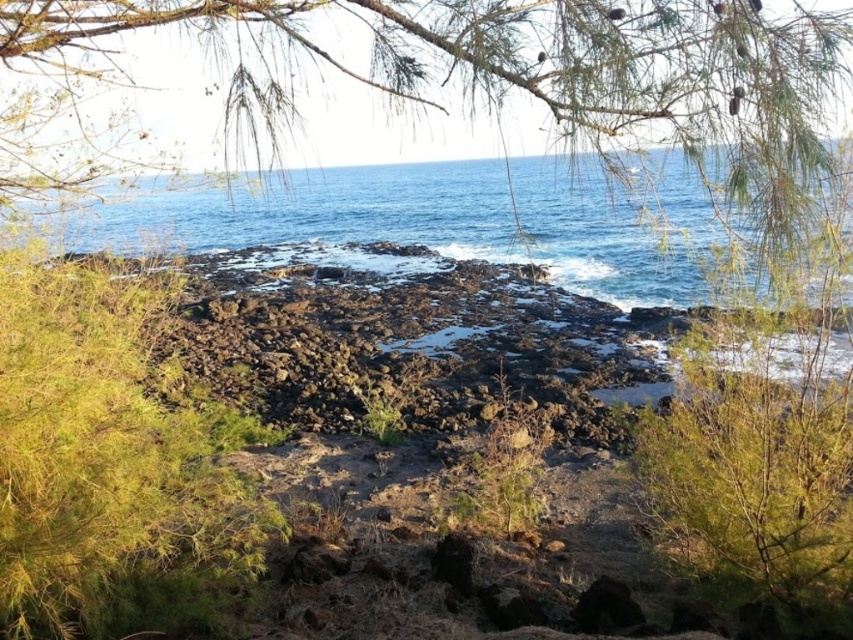
You are standing at the point labeled as point (440,220) in the image. Based on the scene description, what can you see directly in front of you?

You can see blue water at center directly in front of you, as the point (440,220) corresponds to blue water at center according to the description.

You are standing at the edge of the rocky shoreline and want to reach the blue water at center. According to the coordinates given, in which direction should you move to reach it?

The blue water at center is located at coordinates point (440, 220). Since the y coordinate is 0.517, which is above the center point of the image, you should move downward to reach it.

From the picture: You are standing at the point with coordinates point (689, 570) and want to walk towards the point with coordinates point (457, 172). According to the scene, will you be moving towards the foreground or the background?

Since point (457, 172) is behind point (689, 570), moving from point (689, 570) towards point (457, 172) means you are moving towards the background.